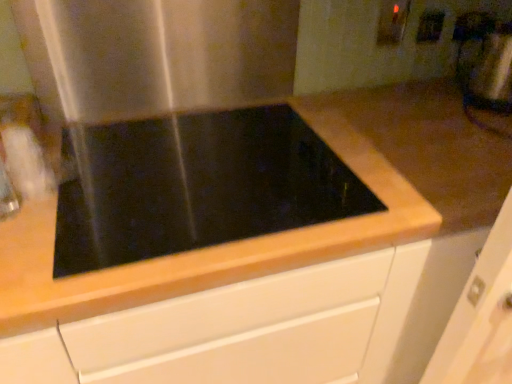
Find the location of a particular element. The image size is (512, 384). free point in front of metallic silver blender at upper right is located at coordinates (487, 124).